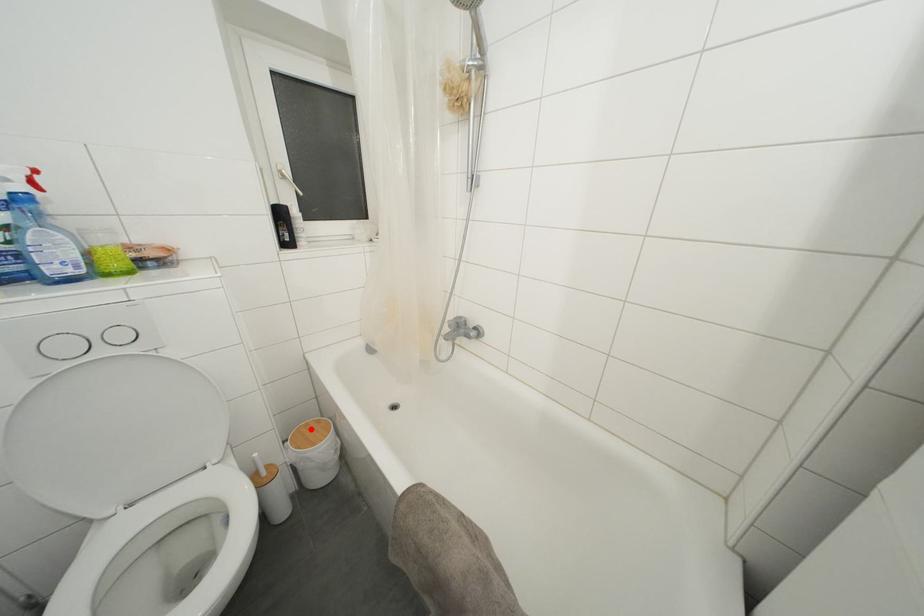
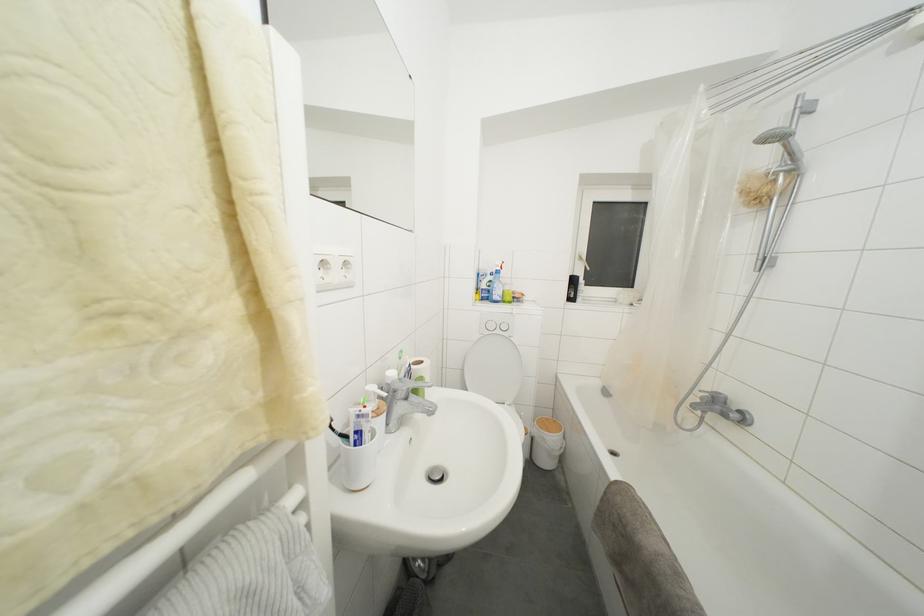
In the second image, find the point that corresponds to the highlighted location in the first image.

(552, 424)